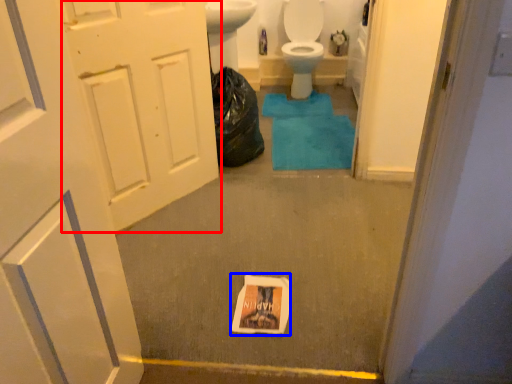
Question: Which object is closer to the camera taking this photo, door (highlighted by a red box) or flyer (highlighted by a blue box)?

Choices:
 (A) door
 (B) flyer

Answer: (A)